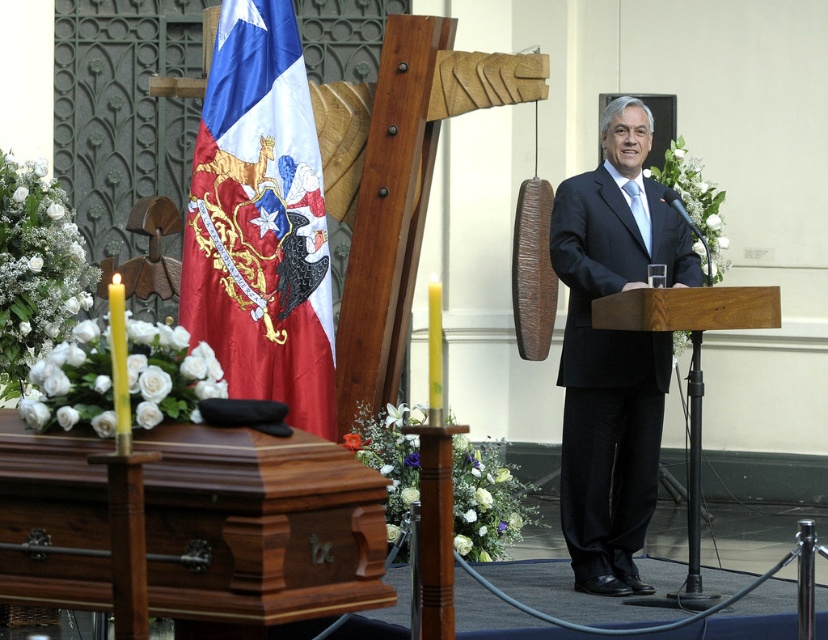
Question: Is satin flag at left above wooden podium at center?

Choices:
 (A) yes
 (B) no

Answer: (A)

Question: Does satin flag at left appear under wooden podium at center?

Choices:
 (A) yes
 (B) no

Answer: (B)

Question: Which point is farther to the camera?

Choices:
 (A) (769, 323)
 (B) (294, 316)

Answer: (B)

Question: Is satin flag at left positioned in front of wooden podium at center?

Choices:
 (A) no
 (B) yes

Answer: (A)

Question: Which point is closer to the camera?

Choices:
 (A) (290, 129)
 (B) (672, 301)

Answer: (B)

Question: Which point is closer to the camera taking this photo?

Choices:
 (A) (215, 164)
 (B) (609, 355)
 (C) (325, 465)
 (D) (696, 582)

Answer: (C)